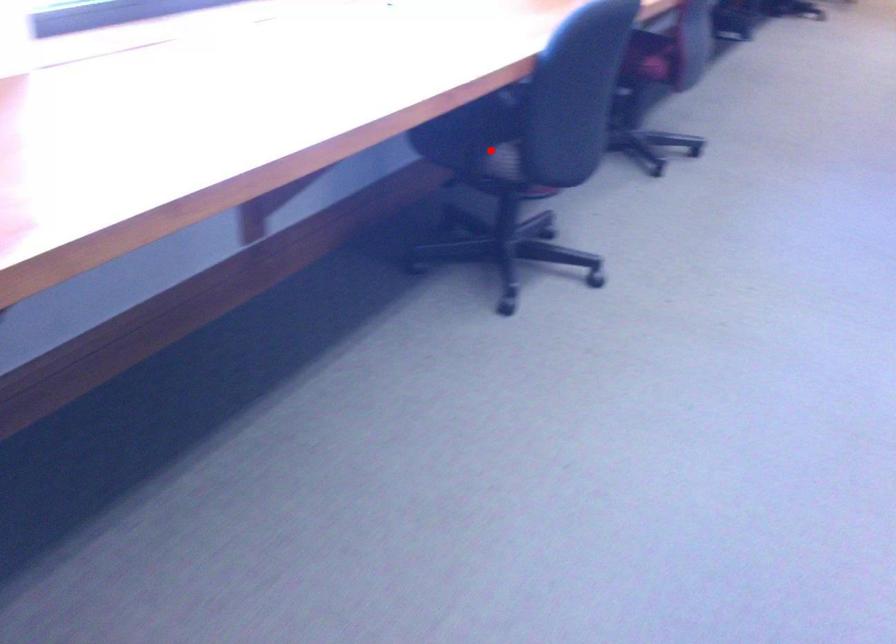
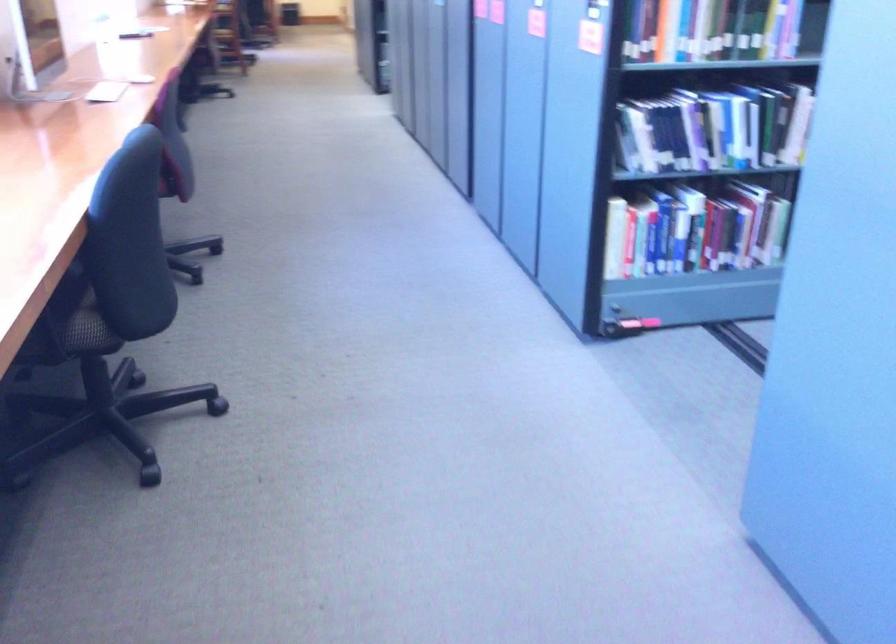
The point at the highlighted location is marked in the first image. Where is the corresponding point in the second image?

(73, 324)